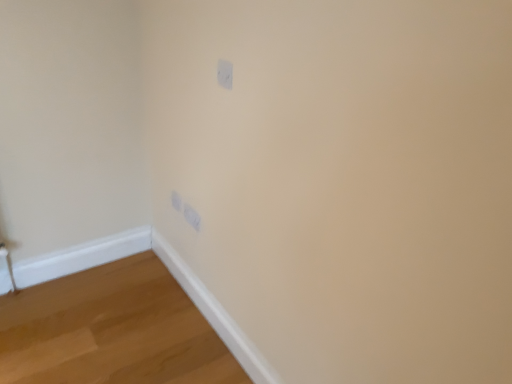
What do you see at coordinates (225, 74) in the screenshot?
I see `white plastic light switch at upper center` at bounding box center [225, 74].

Identify the location of white plastic light switch at upper center. This screenshot has width=512, height=384. (225, 74).

Locate an element on the screen. Image resolution: width=512 pixels, height=384 pixels. white plastic light switch at upper center is located at coordinates (225, 74).